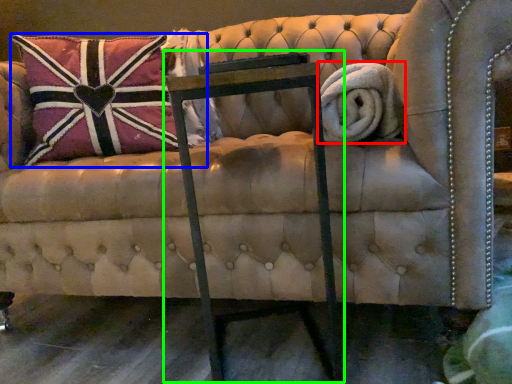
Question: Estimate the real-world distances between objects in this image. Which object is closer to bath towel (highlighted by a red box), pillow (highlighted by a blue box) or rocking chair (highlighted by a green box)?

Choices:
 (A) pillow
 (B) rocking chair

Answer: (B)